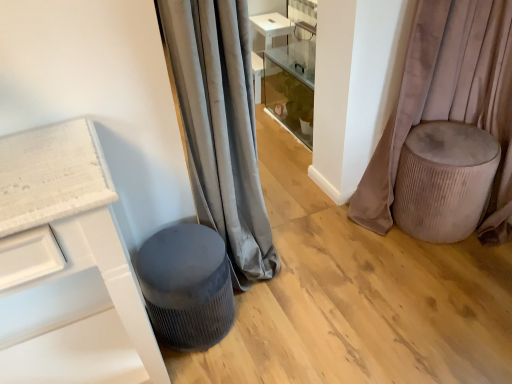
Question: Which direction should I rotate to look at gray velvet curtain at center, which is the 1th curtain from left to right?

Choices:
 (A) right
 (B) left

Answer: (B)

Question: Does velvet beige stool at right, the 2th curtain positioned from the left, lie behind velvet beige ottoman at right?

Choices:
 (A) no
 (B) yes

Answer: (A)

Question: Is velvet beige stool at right, the 2th curtain positioned from the left, taller than velvet beige ottoman at right?

Choices:
 (A) no
 (B) yes

Answer: (B)

Question: Is velvet beige ottoman at right at the back of velvet beige stool at right, the 2th curtain positioned from the left?

Choices:
 (A) yes
 (B) no

Answer: (A)

Question: Is velvet beige stool at right, the 2th curtain positioned from the left, to the right of velvet beige ottoman at right from the viewer's perspective?

Choices:
 (A) yes
 (B) no

Answer: (B)

Question: Is velvet beige stool at right, the 2th curtain positioned from the left, oriented towards velvet beige ottoman at right?

Choices:
 (A) yes
 (B) no

Answer: (A)

Question: Is velvet beige stool at right, the 2th curtain positioned from the left, touching velvet beige ottoman at right?

Choices:
 (A) yes
 (B) no

Answer: (B)

Question: From a real-world perspective, is velvet grey stool at lower left on top of velvet beige stool at right, the 2th curtain positioned from the left?

Choices:
 (A) no
 (B) yes

Answer: (A)

Question: Is velvet grey stool at lower left not near velvet beige stool at right, the 2th curtain positioned from the left?

Choices:
 (A) yes
 (B) no

Answer: (A)

Question: Considering the relative sizes of velvet grey stool at lower left and velvet beige stool at right, the first curtain positioned from the right, in the image provided, is velvet grey stool at lower left thinner than velvet beige stool at right, the first curtain positioned from the right,?

Choices:
 (A) no
 (B) yes

Answer: (A)

Question: Does velvet grey stool at lower left have a greater width compared to velvet beige stool at right, the 2th curtain positioned from the left?

Choices:
 (A) yes
 (B) no

Answer: (A)

Question: Can you confirm if velvet grey stool at lower left is smaller than velvet beige stool at right, the first curtain positioned from the right?

Choices:
 (A) yes
 (B) no

Answer: (A)

Question: Does velvet grey stool at lower left have a greater height compared to velvet beige stool at right, the 2th curtain positioned from the left?

Choices:
 (A) yes
 (B) no

Answer: (B)

Question: Does velvet beige stool at right, the 2th curtain positioned from the left, have a lesser width compared to velvet grey stool at lower left?

Choices:
 (A) yes
 (B) no

Answer: (A)